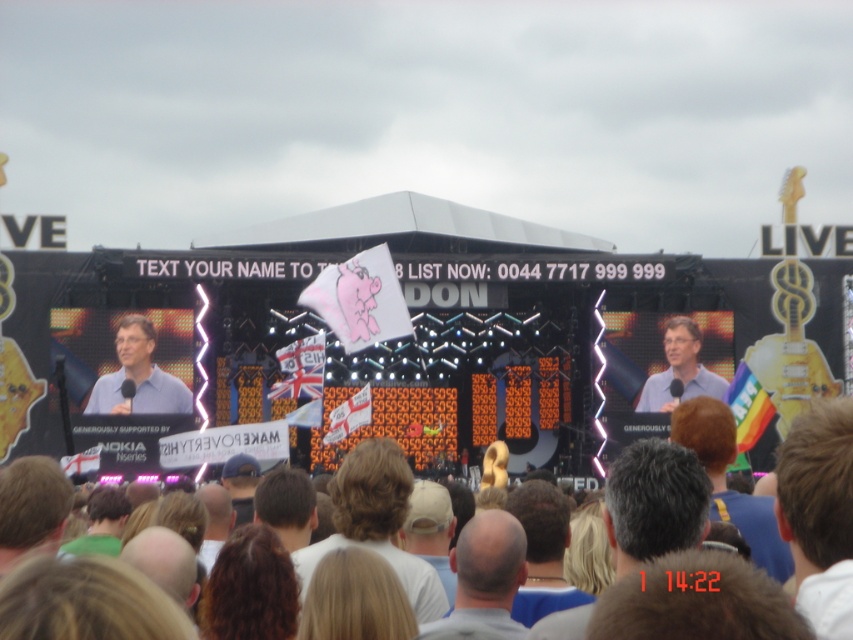
You are standing at the concert stage and need to place a new banner between the two points labeled point (497, 611) and point (653, 385). According to their positions, which point should the banner be closer to in order to be in front?

The banner should be closer to point (497, 611) because it is in front of point (653, 385).